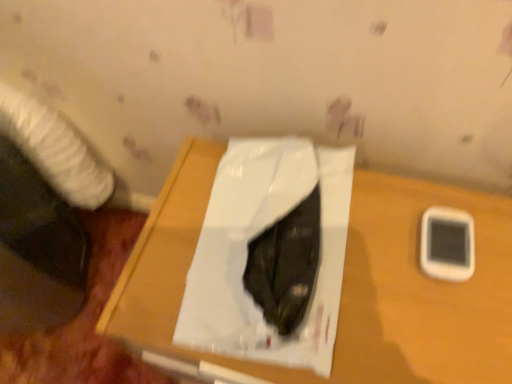
Locate an element on the screen. vacant region in front of white plastic mobile phone at right is located at coordinates (456, 323).